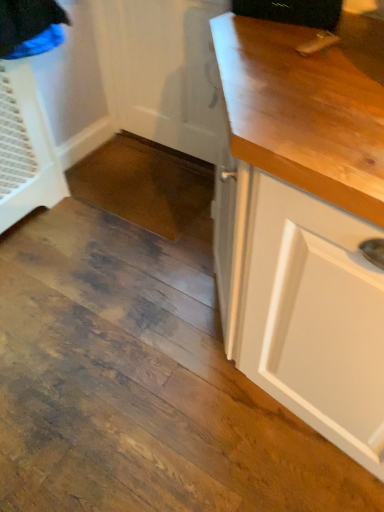
This screenshot has height=512, width=384. I want to click on vacant region under white plastic laundry basket at left (from a real-world perspective), so click(x=34, y=217).